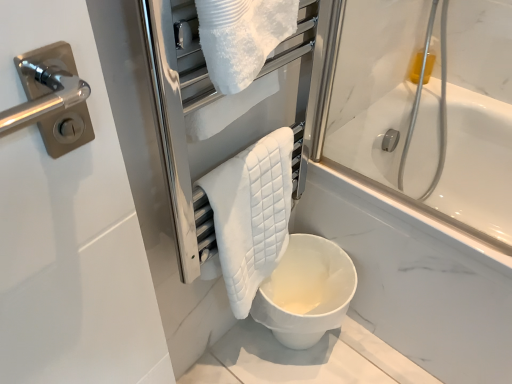
Where is `free space underneath white matte toilet at lower center (from a real-world perspective)`? The width and height of the screenshot is (512, 384). free space underneath white matte toilet at lower center (from a real-world perspective) is located at coordinates (282, 351).